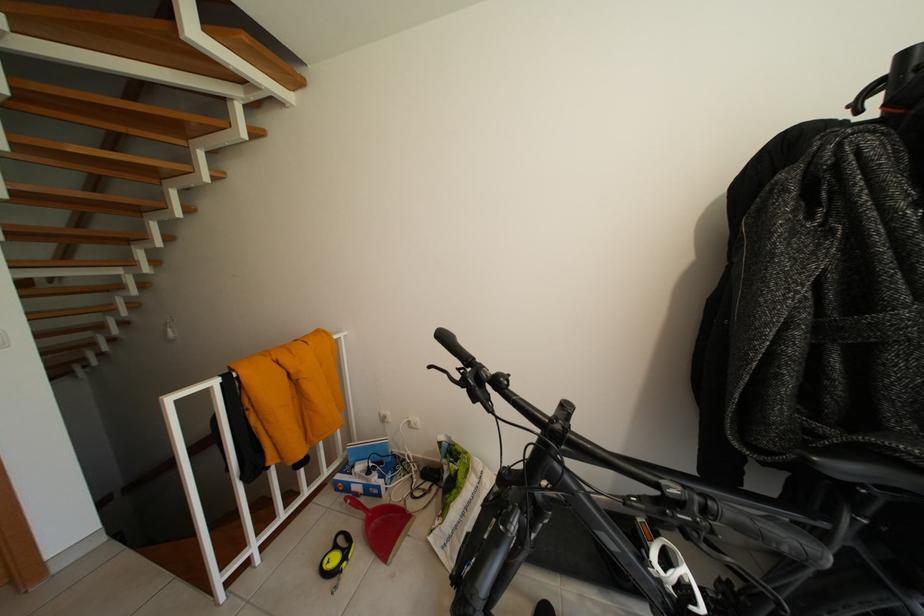
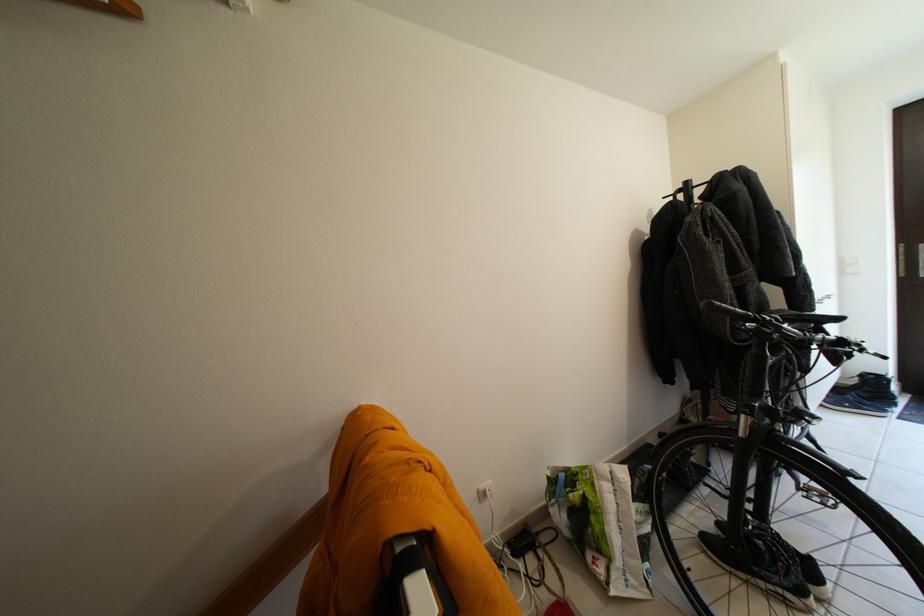
The point at (666, 492) is marked in the first image. Where is the corresponding point in the second image?

(849, 344)